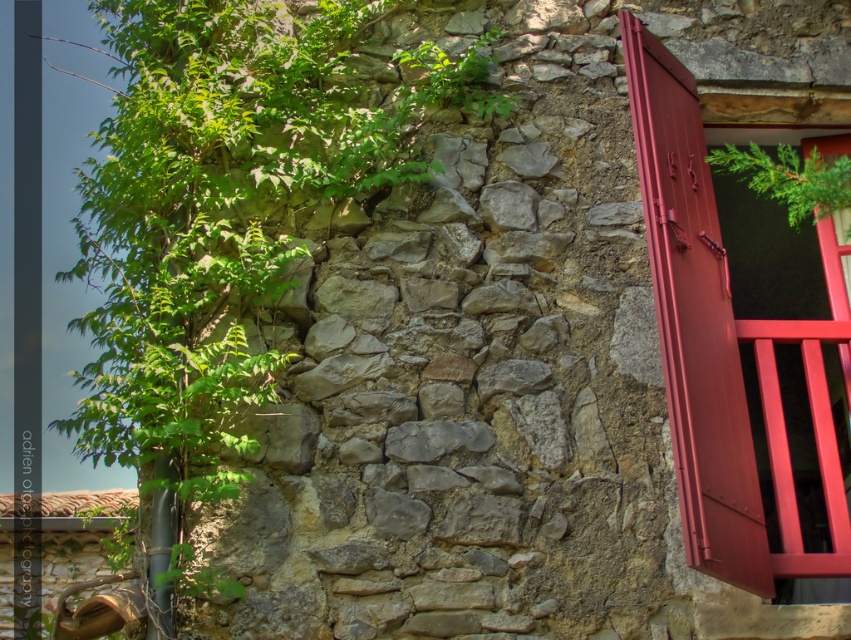
Image resolution: width=851 pixels, height=640 pixels. Describe the element at coordinates (226, 209) in the screenshot. I see `green leafy plant at upper left` at that location.

Between point (197, 400) and point (750, 524), which one is positioned in front?

Point (750, 524) is more forward.

Between point (332, 81) and point (769, 342), which one is positioned in front?

Point (769, 342) is in front.

In order to click on green leafy plant at upper left in this screenshot , I will do `click(226, 209)`.

Can you confirm if matte red wooden door at right is shorter than green leafy plant at upper right?

In fact, matte red wooden door at right may be taller than green leafy plant at upper right.

Is matte red wooden door at right positioned at the back of green leafy plant at upper right?

No, matte red wooden door at right is closer to the viewer.

Image resolution: width=851 pixels, height=640 pixels. What do you see at coordinates (724, 348) in the screenshot?
I see `matte red wooden door at right` at bounding box center [724, 348].

Find the location of `matte red wooden door at right`. matte red wooden door at right is located at coordinates (724, 348).

Is green leafy plant at upper left smaller than green leafy plant at upper right?

Incorrect, green leafy plant at upper left is not smaller in size than green leafy plant at upper right.

Does green leafy plant at upper left have a greater width compared to green leafy plant at upper right?

Correct, the width of green leafy plant at upper left exceeds that of green leafy plant at upper right.

The height and width of the screenshot is (640, 851). What are the coordinates of `green leafy plant at upper left` in the screenshot? It's located at (226, 209).

Where is `green leafy plant at upper left`? The height and width of the screenshot is (640, 851). green leafy plant at upper left is located at coordinates (226, 209).